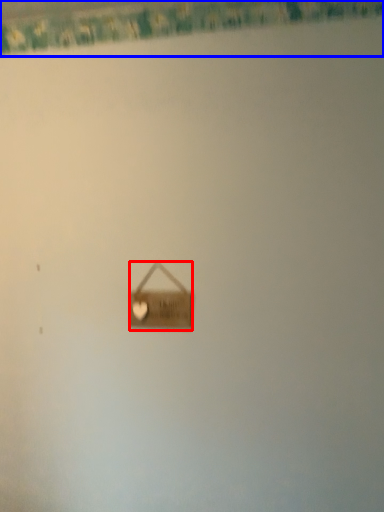
Question: Which object appears closest to the camera in this image, handbag (highlighted by a red box) or curtain (highlighted by a blue box)?

Choices:
 (A) handbag
 (B) curtain

Answer: (B)